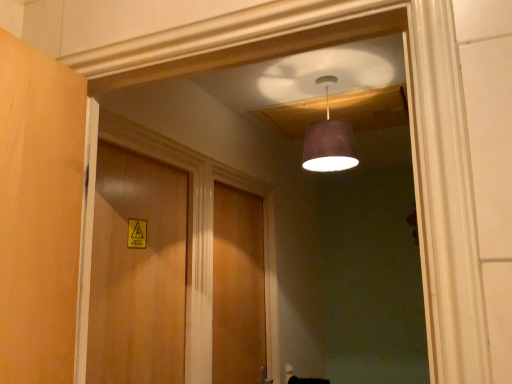
Question: Looking at their shapes, would you say wooden door at center, acting as the 1th door starting from the back, is wider or thinner than matte purple lampshade at upper center?

Choices:
 (A) thin
 (B) wide

Answer: (A)

Question: Is wooden door at center, acting as the 1th door starting from the back, in front of or behind matte purple lampshade at upper center in the image?

Choices:
 (A) front
 (B) behind

Answer: (B)

Question: Which object is positioned farthest from the wooden door at center, the 2th door in the right-to-left sequence?

Choices:
 (A) matte purple lampshade at upper center
 (B) wooden door at center, the 1th door viewed from the right

Answer: (A)

Question: Estimate the real-world distances between objects in this image. Which object is closer to the matte purple lampshade at upper center?

Choices:
 (A) wooden door at center, which appears as the second door when viewed from the left
 (B) wooden door at center, the 2th door in the right-to-left sequence

Answer: (B)